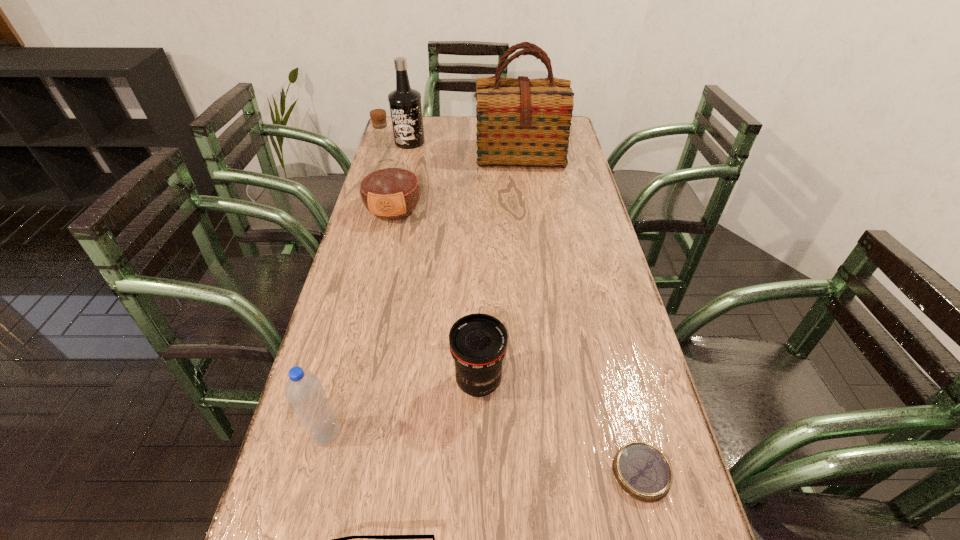
Where is `shopping bag`? This screenshot has height=540, width=960. shopping bag is located at coordinates (520, 122).

The height and width of the screenshot is (540, 960). I want to click on the nearer liquor, so click(x=390, y=190).

Locate an element on the screen. the farther liquor is located at coordinates (405, 103).

Where is `water bottle`? The image size is (960, 540). water bottle is located at coordinates (306, 394).

In order to click on the third shortest object in this screenshot , I will do `click(478, 342)`.

Find the location of a particular element. The height and width of the screenshot is (540, 960). the fourth nearest object is located at coordinates (478, 342).

The image size is (960, 540). I want to click on the shortest object, so click(642, 471).

Where is `free location located on the open handle side of the shopping bag`? The image size is (960, 540). free location located on the open handle side of the shopping bag is located at coordinates (528, 223).

You are a GUI agent. You are given a task and a screenshot of the screen. Output one action in this format:
    pyautogui.click(x=<x>, y=<y>)
    Task: Click on the free region located on the front label of the nearer liquor
    This screenshot has width=960, height=540.
    Given the screenshot: What is the action you would take?
    [386, 244]

Where is `vacant space located on the front label of the farther liquor`? This screenshot has width=960, height=540. vacant space located on the front label of the farther liquor is located at coordinates (406, 159).